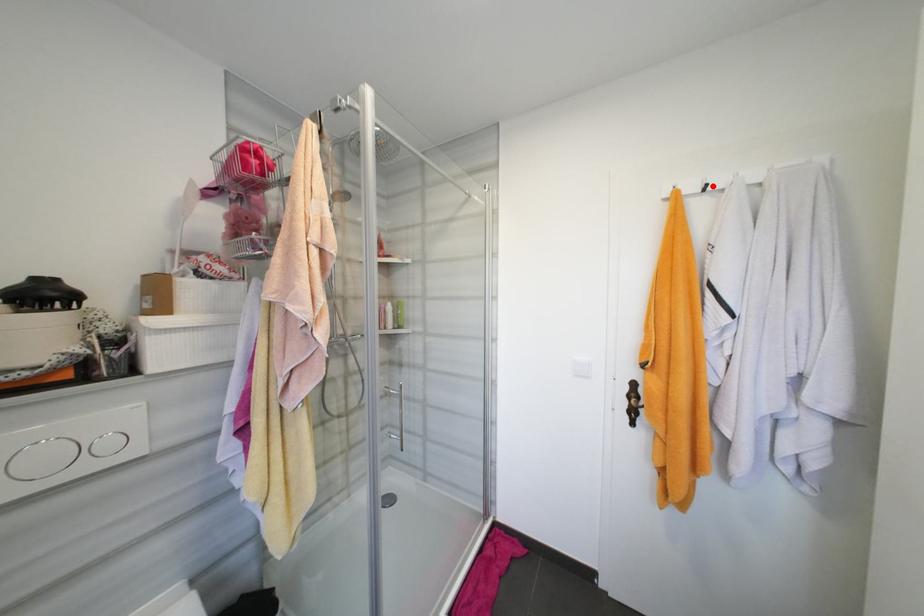
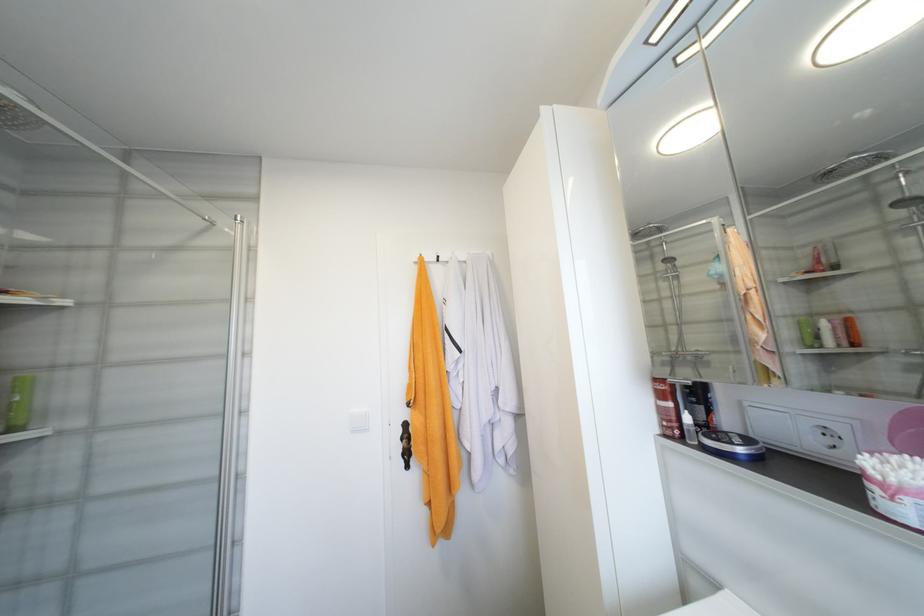
The point at the highlighted location is marked in the first image. Where is the corresponding point in the second image?

(444, 257)